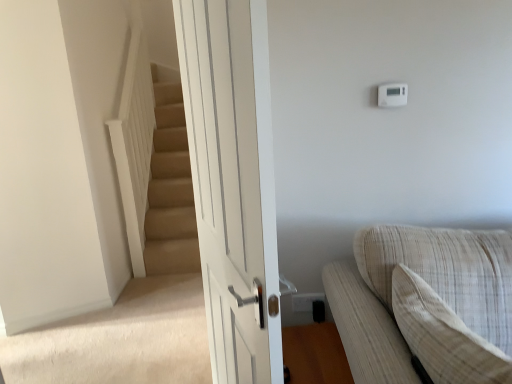
Question: Is the position of beige textured couch at lower right more distant than that of white plastic thermostat at upper right?

Choices:
 (A) no
 (B) yes

Answer: (A)

Question: Is beige textured couch at lower right far away from white plastic thermostat at upper right?

Choices:
 (A) no
 (B) yes

Answer: (A)

Question: Does beige textured couch at lower right turn towards white plastic thermostat at upper right?

Choices:
 (A) no
 (B) yes

Answer: (A)

Question: Is beige textured couch at lower right to the right of white plastic thermostat at upper right from the viewer's perspective?

Choices:
 (A) yes
 (B) no

Answer: (A)

Question: Is white plastic thermostat at upper right located within beige textured couch at lower right?

Choices:
 (A) no
 (B) yes

Answer: (A)

Question: Can you confirm if beige textured couch at lower right is bigger than white plastic thermostat at upper right?

Choices:
 (A) no
 (B) yes

Answer: (B)

Question: Is white plastic electric outlet at lower right to the left of light beige textured pillow at right from the viewer's perspective?

Choices:
 (A) no
 (B) yes

Answer: (B)

Question: Can you confirm if white plastic electric outlet at lower right is bigger than light beige textured pillow at right?

Choices:
 (A) no
 (B) yes

Answer: (A)

Question: Is light beige textured pillow at right completely or partially inside white plastic electric outlet at lower right?

Choices:
 (A) no
 (B) yes

Answer: (A)

Question: Does white plastic electric outlet at lower right turn towards light beige textured pillow at right?

Choices:
 (A) no
 (B) yes

Answer: (B)

Question: From a real-world perspective, is white plastic electric outlet at lower right physically below light beige textured pillow at right?

Choices:
 (A) yes
 (B) no

Answer: (A)

Question: Can you confirm if white plastic electric outlet at lower right is smaller than light beige textured pillow at right?

Choices:
 (A) no
 (B) yes

Answer: (B)

Question: Is light beige textured pillow at right completely or partially outside of white plastic electric outlet at lower right?

Choices:
 (A) no
 (B) yes

Answer: (B)